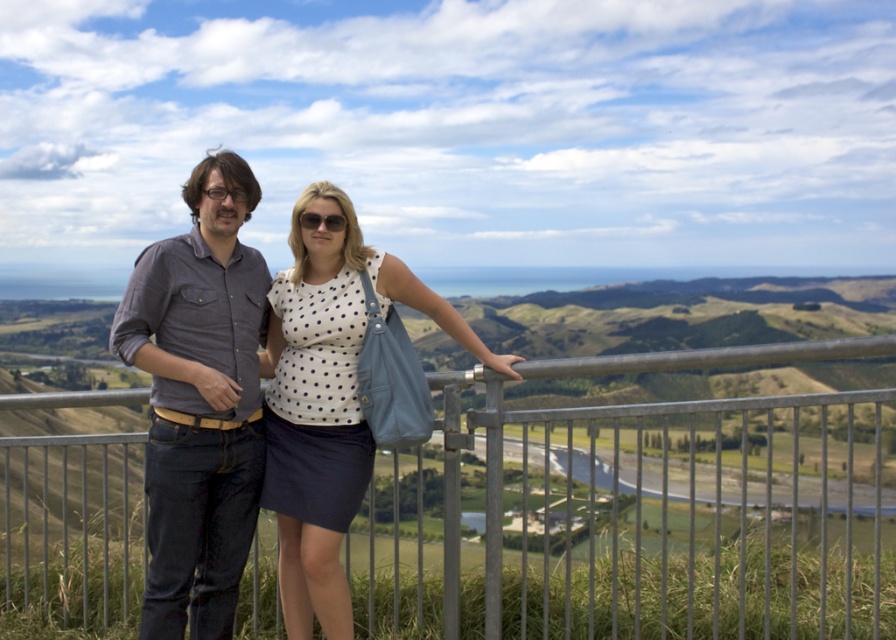
You are a photographer trying to capture a photo of the dark gray shirt at center and the metallic gray fence at center. Which object is positioned lower in the image?

The metallic gray fence at center is located below dark gray shirt at center, so it is positioned lower in the image.

You are a photographer positioned at the center of the scene. You want to take a photo of the dark gray shirt at center. Where should you aim your camera?

You should aim your camera at point (199, 401) to capture the dark gray shirt at center.

You are a photographer trying to capture the perfect shot of the dark gray shirt at center. The camera you are using has a focal point that can only focus on objects within a 0.15 unit radius from the selected point. If you choose the point at coordinates point (199,401) as your focus, will the dark gray shirt at center be in focus?

The dark gray shirt at center is represented by point (199,401), so yes, selecting the point at coordinates point (199,401) as the focus will ensure the dark gray shirt at center is in focus since it is exactly at that point.